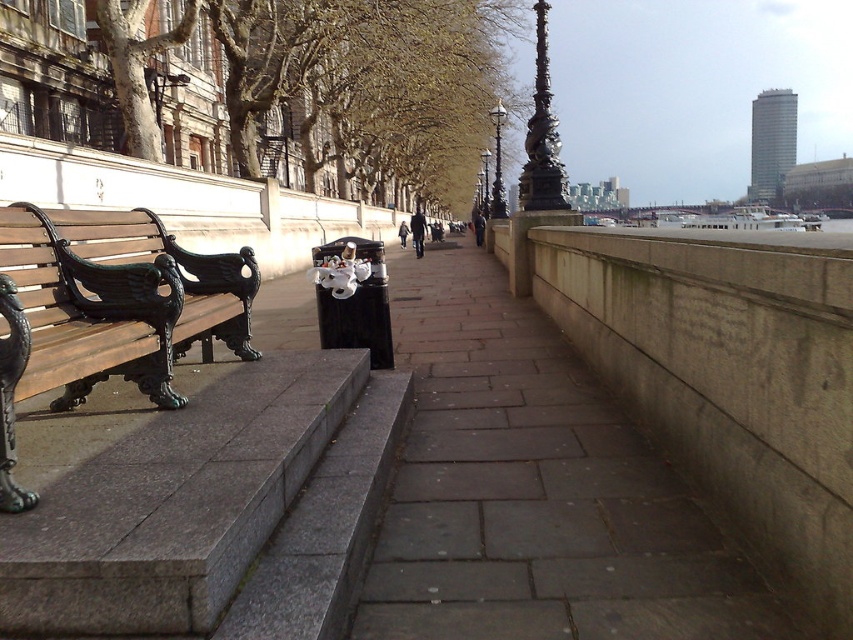
Question: Which of the following is the closest to the observer?

Choices:
 (A) matte brown bench at left
 (B) gray concrete sidewalk at center

Answer: (A)

Question: Which point is closer to the camera?

Choices:
 (A) matte brown bench at left
 (B) gray concrete sidewalk at center

Answer: (A)

Question: Among these points, which one is farthest from the camera?

Choices:
 (A) (3, 220)
 (B) (666, 609)

Answer: (A)

Question: Is gray concrete sidewalk at center wider than matte brown bench at left?

Choices:
 (A) yes
 (B) no

Answer: (A)

Question: Does gray concrete sidewalk at center have a greater width compared to matte brown bench at left?

Choices:
 (A) yes
 (B) no

Answer: (A)

Question: Does gray concrete sidewalk at center appear on the right side of matte brown bench at left?

Choices:
 (A) yes
 (B) no

Answer: (A)